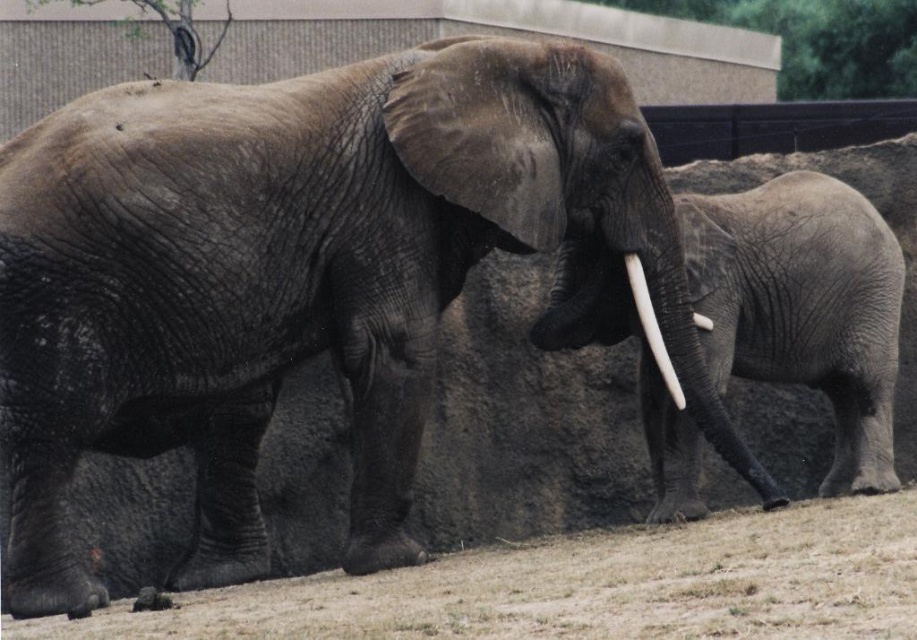
Is gray wrinkled skin elephant at right in front of white ivory tusk at right?

No.

Is point (818, 264) less distant than point (709, 317)?

That is False.

Locate an element on the screen. The image size is (917, 640). gray wrinkled skin elephant at right is located at coordinates (804, 305).

Is point (637, 305) closer to viewer compared to point (702, 316)?

Yes, it is.

Is white ivory tusk at center to the right of white ivory tusk at right from the viewer's perspective?

Incorrect, white ivory tusk at center is not on the right side of white ivory tusk at right.

Measure the distance between point (x=649, y=314) and camera.

The distance of point (x=649, y=314) from camera is 27.34 feet.

The image size is (917, 640). I want to click on white ivory tusk at center, so pos(652,328).

Does gray wrinkled skin elephant at right have a smaller size compared to white ivory tusk at center?

No, gray wrinkled skin elephant at right is not smaller than white ivory tusk at center.

Find the location of a particular element. The height and width of the screenshot is (640, 917). gray wrinkled skin elephant at right is located at coordinates (804, 305).

In order to click on gray wrinkled skin elephant at right in this screenshot , I will do `click(804, 305)`.